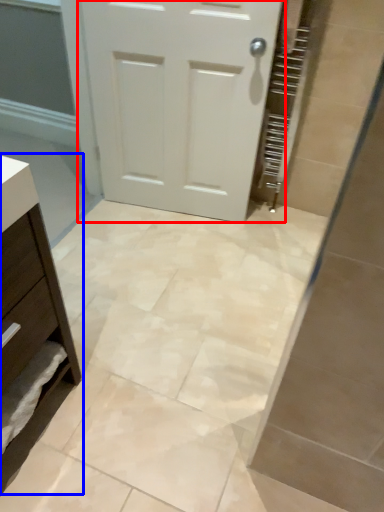
Question: Among these objects, which one is farthest to the camera, door (highlighted by a red box) or chest of drawers (highlighted by a blue box)?

Choices:
 (A) door
 (B) chest of drawers

Answer: (A)